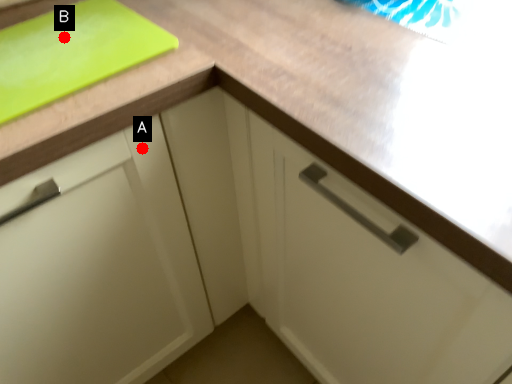
Question: Two points are circled on the image, labeled by A and B beside each circle. Which point is further to the camera?

Choices:
 (A) A is further
 (B) B is further

Answer: (B)